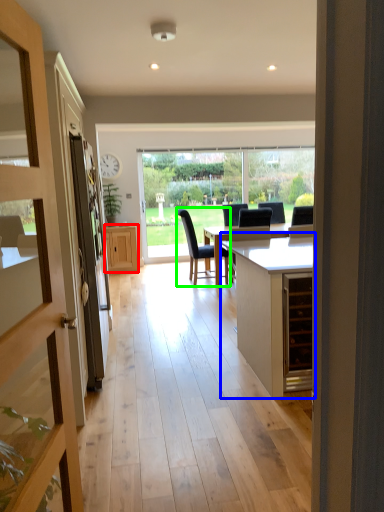
Question: Based on their relative distances, which object is farther from cabinetry (highlighted by a red box)? Choose from cabinetry (highlighted by a blue box) and chair (highlighted by a green box).

Choices:
 (A) cabinetry
 (B) chair

Answer: (A)